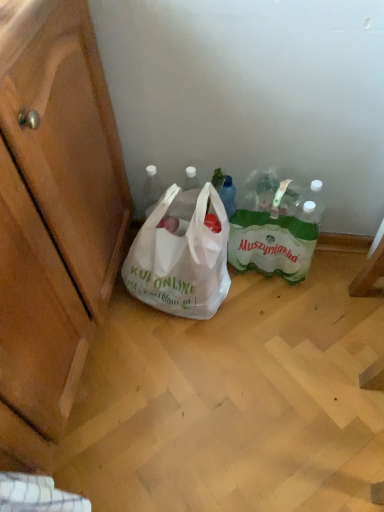
Find the location of a particular element. Image resolution: width=384 pixels, height=512 pixels. free space in front of white plastic bag at center is located at coordinates (183, 356).